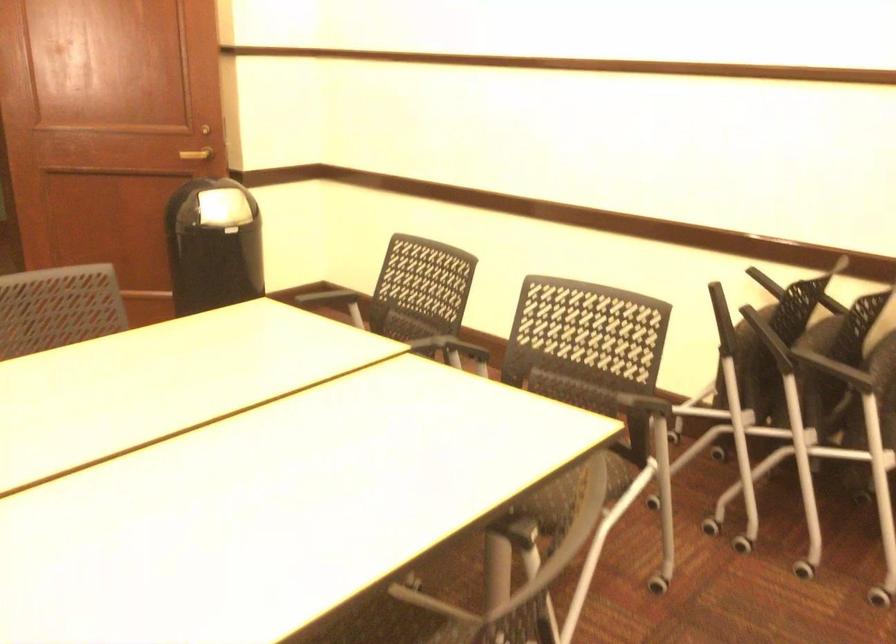
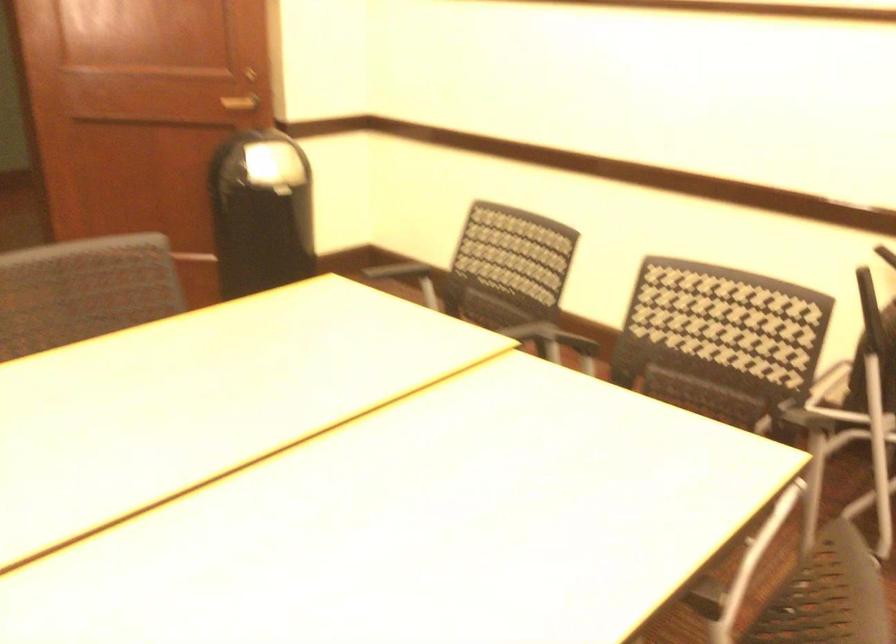
The images are taken continuously from a first-person perspective. In which direction are you moving?

The cameraman moved toward left, forward.